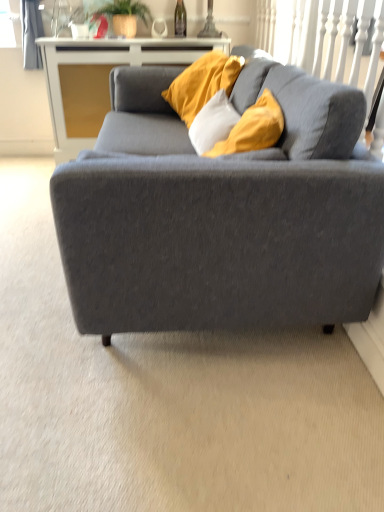
Question: In terms of size, does green glass wine bottle at upper center appear bigger or smaller than green leafy plant at upper center?

Choices:
 (A) small
 (B) big

Answer: (A)

Question: From the image's perspective, is green glass wine bottle at upper center located above or below green leafy plant at upper center?

Choices:
 (A) above
 (B) below

Answer: (A)

Question: Estimate the real-world distances between objects in this image. Which object is farther from the green leafy plant at upper center?

Choices:
 (A) matte gray couch at center
 (B) green glass wine bottle at upper center
 (C) white glossy cabinet at upper center

Answer: (A)

Question: Based on their relative distances, which object is farther from the white glossy cabinet at upper center?

Choices:
 (A) matte gray couch at center
 (B) green glass wine bottle at upper center
 (C) green leafy plant at upper center

Answer: (A)